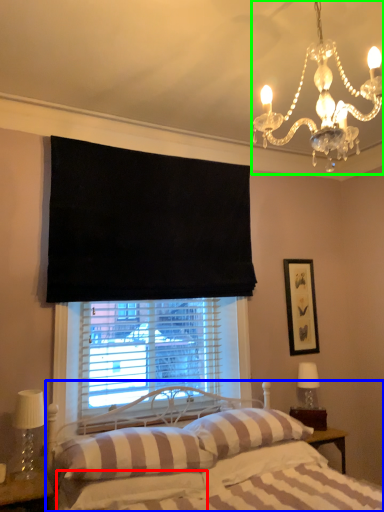
Question: Which object is the farthest from sheet (highlighted by a red box)? Choose among these: bed (highlighted by a blue box) or light fixture (highlighted by a green box).

Choices:
 (A) bed
 (B) light fixture

Answer: (B)